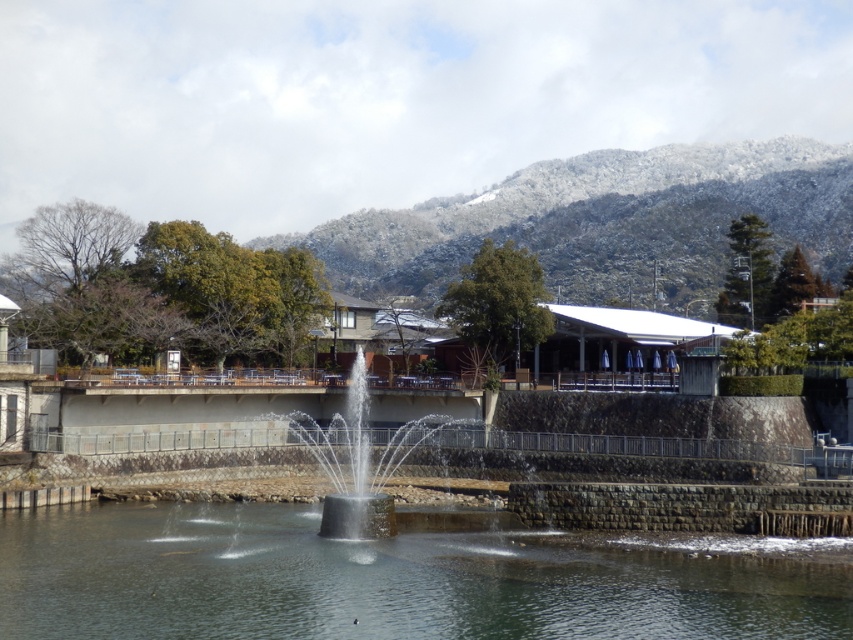
Question: Can you confirm if clear water at center is thinner than black concrete fountain at center?

Choices:
 (A) no
 (B) yes

Answer: (A)

Question: Which is farther from the black concrete fountain at center?

Choices:
 (A) snow-covered mountain at upper center
 (B) clear water at center

Answer: (A)

Question: Considering the relative positions of snow-covered mountain at upper center and black concrete fountain at center in the image provided, where is snow-covered mountain at upper center located with respect to black concrete fountain at center?

Choices:
 (A) right
 (B) left

Answer: (A)

Question: Is clear water at center to the left of black concrete fountain at center from the viewer's perspective?

Choices:
 (A) yes
 (B) no

Answer: (A)

Question: Which object is the closest to the snow-covered mountain at upper center?

Choices:
 (A) black concrete fountain at center
 (B) clear water at center

Answer: (A)

Question: Estimate the real-world distances between objects in this image. Which object is farther from the clear water at center?

Choices:
 (A) snow-covered mountain at upper center
 (B) black concrete fountain at center

Answer: (A)